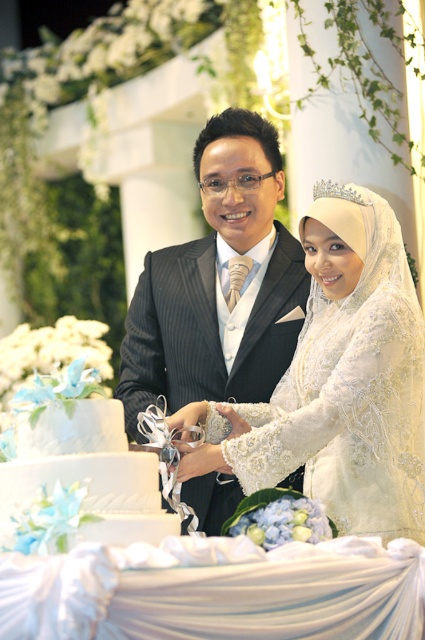
Question: Considering the relative positions of white lace dress at center and matte black suit at center in the image provided, where is white lace dress at center located with respect to matte black suit at center?

Choices:
 (A) left
 (B) right

Answer: (B)

Question: Which of the following is the farthest from the observer?

Choices:
 (A) (70, 432)
 (B) (289, 394)

Answer: (B)

Question: Which object is farther from the camera taking this photo?

Choices:
 (A) white lace dress at center
 (B) matte black suit at center
 (C) white textured cake at center

Answer: (B)

Question: Estimate the real-world distances between objects in this image. Which object is farther from the white textured cake at center?

Choices:
 (A) white lace dress at center
 (B) matte black suit at center

Answer: (B)

Question: Observing the image, what is the correct spatial positioning of white lace dress at center in reference to white textured cake at center?

Choices:
 (A) right
 (B) left

Answer: (A)

Question: Is white lace dress at center to the right of white textured cake at center from the viewer's perspective?

Choices:
 (A) yes
 (B) no

Answer: (A)